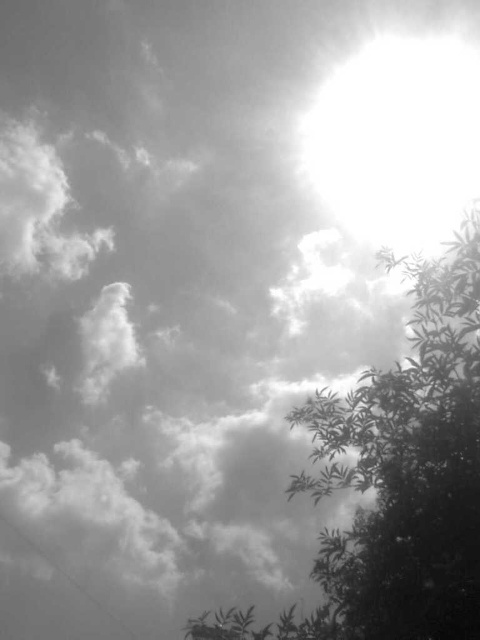
Question: In this image, where is silhouetted leafy branch at lower right located relative to bright white sun at upper right?

Choices:
 (A) left
 (B) right

Answer: (A)

Question: Can you confirm if silhouetted leafy branch at lower right is bigger than bright white sun at upper right?

Choices:
 (A) yes
 (B) no

Answer: (A)

Question: In this image, where is silhouetted leafy branch at lower right located relative to bright white sun at upper right?

Choices:
 (A) right
 (B) left

Answer: (B)

Question: Which of the following is the closest to the observer?

Choices:
 (A) (421, 36)
 (B) (345, 611)

Answer: (B)